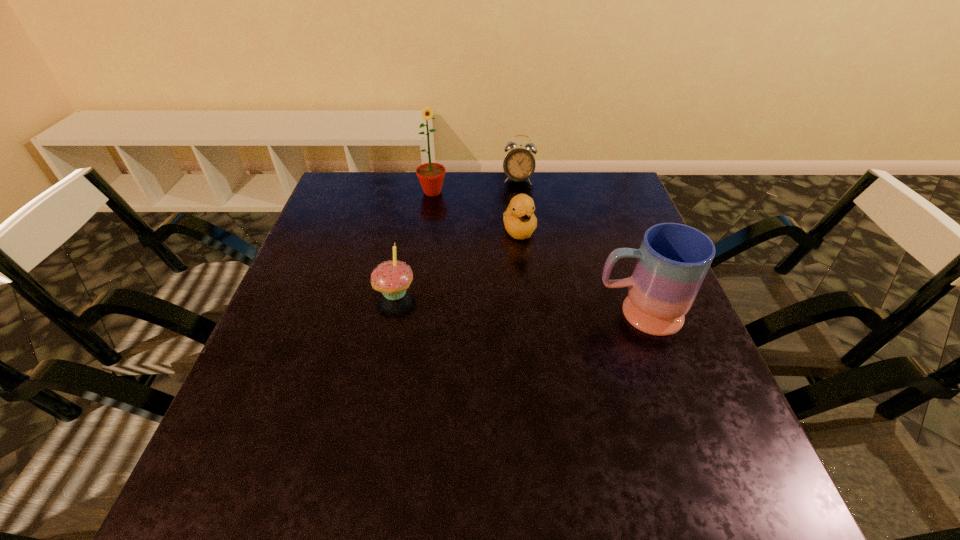
At what (x,y) coordinates should I click in order to perform the action: click on vacant space that satisfies the following two spatial constraints: 1. on the back side of the sunflower; 2. on the left side of the alarm clock. Please return your answer as a coordinate pair (x, y). This screenshot has width=960, height=540. Looking at the image, I should click on (434, 180).

The image size is (960, 540). I want to click on free space that satisfies the following two spatial constraints: 1. on the front side of the alarm clock; 2. on the side of the mug with the handle, so click(535, 313).

Where is `vacant region that satisfies the following two spatial constraints: 1. on the front side of the fourth shortest object; 2. on the side of the cupcake with the handle`? This screenshot has height=540, width=960. vacant region that satisfies the following two spatial constraints: 1. on the front side of the fourth shortest object; 2. on the side of the cupcake with the handle is located at coordinates pyautogui.click(x=391, y=313).

This screenshot has height=540, width=960. I want to click on vacant area in the image that satisfies the following two spatial constraints: 1. on the back side of the third farthest object; 2. on the left side of the alarm clock, so click(x=514, y=180).